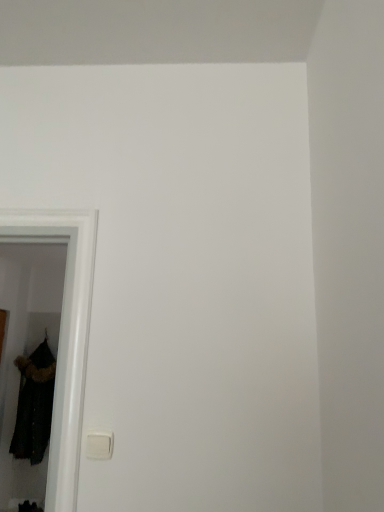
Question: Which is correct: velvet black coat at left is inside white plastic light switch at lower left, or outside of it?

Choices:
 (A) inside
 (B) outside

Answer: (B)

Question: Considering their positions, is velvet black coat at left located in front of or behind white plastic light switch at lower left?

Choices:
 (A) front
 (B) behind

Answer: (B)

Question: Visually, is velvet black coat at left positioned to the left or to the right of white plastic light switch at lower left?

Choices:
 (A) left
 (B) right

Answer: (A)

Question: Considering the positions of point (107, 449) and point (44, 348), is point (107, 449) closer or farther from the camera than point (44, 348)?

Choices:
 (A) closer
 (B) farther

Answer: (A)

Question: Is white plastic light switch at lower left to the left or to the right of velvet black coat at left in the image?

Choices:
 (A) left
 (B) right

Answer: (B)

Question: Is white plastic light switch at lower left situated inside velvet black coat at left or outside?

Choices:
 (A) inside
 (B) outside

Answer: (B)

Question: From the image's perspective, is white plastic light switch at lower left positioned above or below velvet black coat at left?

Choices:
 (A) above
 (B) below

Answer: (A)